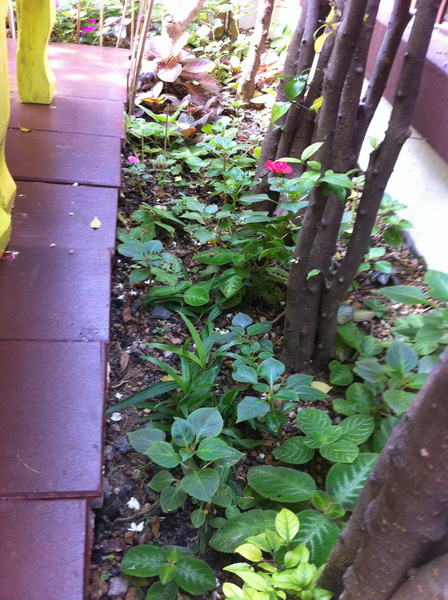
Where is `table leg`? table leg is located at coordinates (8, 196), (3, 229), (2, 102), (35, 43).